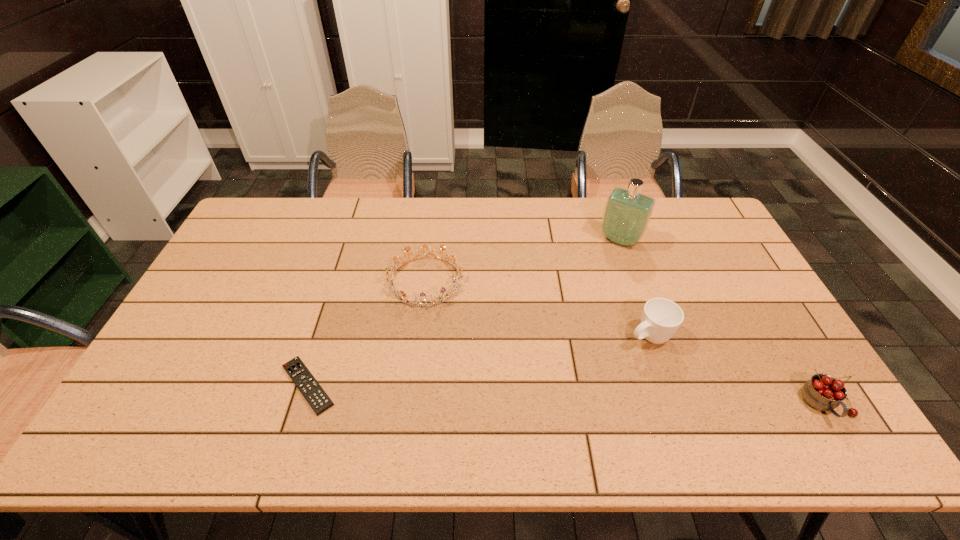
Locate an element on the screen. This screenshot has height=540, width=960. empty space that is in between the pot filled with cherries and the cup is located at coordinates (737, 370).

Where is `vacant space that is in between the tallest object and the tiara`? vacant space that is in between the tallest object and the tiara is located at coordinates (523, 260).

Where is `empty space between the shortest object and the cup`? This screenshot has width=960, height=540. empty space between the shortest object and the cup is located at coordinates (478, 361).

This screenshot has width=960, height=540. Find the location of `vacant space that's between the perfume and the rightmost object`. vacant space that's between the perfume and the rightmost object is located at coordinates (724, 322).

The width and height of the screenshot is (960, 540). Find the location of `free area in between the remote control and the third farthest object`. free area in between the remote control and the third farthest object is located at coordinates (478, 361).

The height and width of the screenshot is (540, 960). I want to click on vacant space in between the shortest object and the cup, so click(478, 361).

Where is `vacant space that's between the pot filled with cherries and the farthest object`? vacant space that's between the pot filled with cherries and the farthest object is located at coordinates (724, 322).

You are a GUI agent. You are given a task and a screenshot of the screen. Output one action in this format:
    pyautogui.click(x=<x>, y=<y>)
    Task: Click on the vacant space that's between the remote control and the tallest object
    
    Given the screenshot: What is the action you would take?
    pyautogui.click(x=464, y=313)

Locate an element on the screen. unoccupied area between the third nearest object and the fourth object from right to left is located at coordinates (537, 308).

In order to click on object that can be found as the second closest to the cup in this screenshot , I will do `click(627, 213)`.